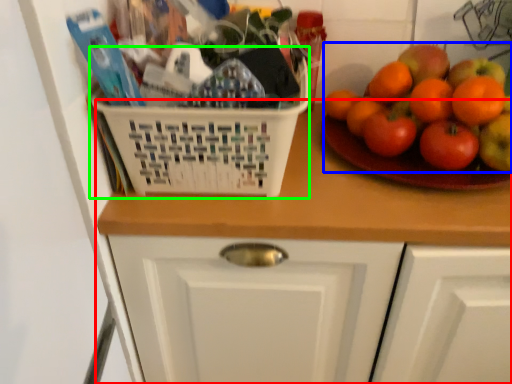
Question: Which object is the closest to the counter (highlighted by a red box)? Choose among these: fruit (highlighted by a blue box) or basket (highlighted by a green box).

Choices:
 (A) fruit
 (B) basket

Answer: (B)